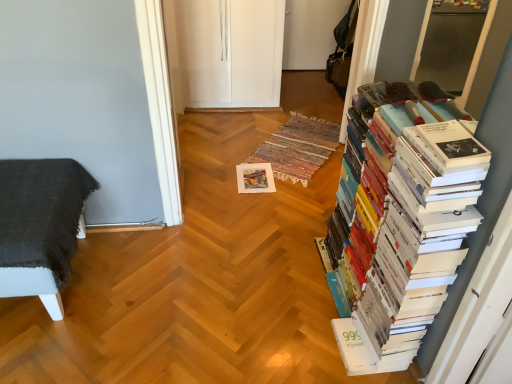
Question: Is white paper book at right touching white paper at center?

Choices:
 (A) yes
 (B) no

Answer: (B)

Question: From the image's perspective, is white paper book at right over white paper at center?

Choices:
 (A) yes
 (B) no

Answer: (B)

Question: Considering the relative sizes of white paper book at right and white paper at center in the image provided, is white paper book at right thinner than white paper at center?

Choices:
 (A) no
 (B) yes

Answer: (B)

Question: Does white paper book at right have a larger size compared to white paper at center?

Choices:
 (A) yes
 (B) no

Answer: (A)

Question: Is white paper book at right to the left of white paper at center from the viewer's perspective?

Choices:
 (A) yes
 (B) no

Answer: (B)

Question: Is dark gray woven blanket on the left spatially inside white paper at center, or outside of it?

Choices:
 (A) outside
 (B) inside

Answer: (A)

Question: Does point (44, 168) appear closer or farther from the camera than point (267, 182)?

Choices:
 (A) farther
 (B) closer

Answer: (B)

Question: From the image's perspective, is dark gray woven blanket on the left positioned above or below white paper at center?

Choices:
 (A) below
 (B) above

Answer: (A)

Question: Considering the positions of dark gray woven blanket on the left and white paper at center in the image, is dark gray woven blanket on the left taller or shorter than white paper at center?

Choices:
 (A) tall
 (B) short

Answer: (A)

Question: From a real-world perspective, is white paper book at right positioned above or below dark gray woven blanket on the left?

Choices:
 (A) below
 (B) above

Answer: (B)

Question: Considering the positions of white paper book at right and dark gray woven blanket on the left in the image, is white paper book at right taller or shorter than dark gray woven blanket on the left?

Choices:
 (A) tall
 (B) short

Answer: (A)

Question: Is white paper book at right to the left or to the right of dark gray woven blanket on the left in the image?

Choices:
 (A) right
 (B) left

Answer: (A)

Question: Considering the positions of white paper book at right and dark gray woven blanket on the left in the image, is white paper book at right bigger or smaller than dark gray woven blanket on the left?

Choices:
 (A) small
 (B) big

Answer: (B)

Question: From their relative heights in the image, would you say dark gray woven blanket on the left is taller or shorter than white paper book at right?

Choices:
 (A) short
 (B) tall

Answer: (A)

Question: Considering the positions of point (5, 198) and point (422, 301), is point (5, 198) closer or farther from the camera than point (422, 301)?

Choices:
 (A) closer
 (B) farther

Answer: (B)